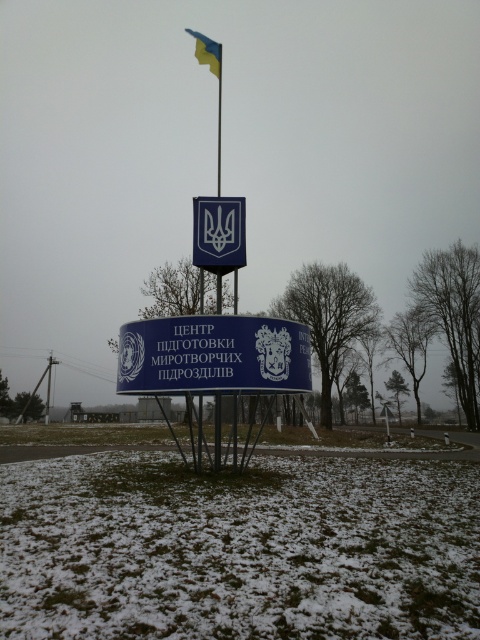
Question: Does blue plastic sign at center appear on the right side of blue matte sign at center?

Choices:
 (A) yes
 (B) no

Answer: (A)

Question: Does blue plastic sign at center have a smaller size compared to blue matte sign at center?

Choices:
 (A) no
 (B) yes

Answer: (B)

Question: Where is blue plastic sign at center located in relation to blue fabric flag at upper center in the image?

Choices:
 (A) above
 (B) below

Answer: (B)

Question: Which point is closer to the camera?

Choices:
 (A) (178, 326)
 (B) (200, 212)
 (C) (214, 54)

Answer: (A)

Question: Which object appears farthest from the camera in this image?

Choices:
 (A) blue matte sign at center
 (B) blue fabric flag at upper center
 (C) blue plastic sign at center

Answer: (B)

Question: Which point is farther to the camera?

Choices:
 (A) blue matte sign at center
 (B) blue fabric flag at upper center
 (C) blue plastic sign at center

Answer: (B)